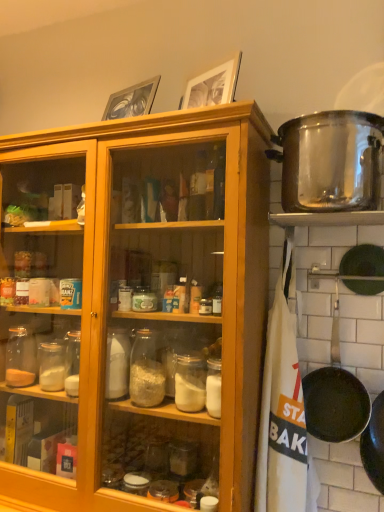
What do you see at coordinates (330, 161) in the screenshot?
I see `stainless steel pot at upper right` at bounding box center [330, 161].

At what (x,y) coordinates should I click in order to perform the action: click on stainless steel pot at upper right. Please return your answer as a coordinate pair (x, y). Image resolution: width=384 pixels, height=512 pixels. Looking at the image, I should click on (x=330, y=161).

What is the approximate height of black non-stick frying pan at lower right?

41.88 centimeters.

The height and width of the screenshot is (512, 384). Identify the location of black non-stick frying pan at lower right. (335, 397).

What do you see at coordinates (335, 397) in the screenshot? I see `black non-stick frying pan at lower right` at bounding box center [335, 397].

Locate an element on the screen. stainless steel pot at upper right is located at coordinates (330, 161).

Which is more to the left, stainless steel pot at upper right or black non-stick frying pan at lower right?

Positioned to the left is stainless steel pot at upper right.

Who is more distant, stainless steel pot at upper right or black non-stick frying pan at lower right?

Positioned behind is black non-stick frying pan at lower right.

Does point (325, 129) appear closer or farther from the camera than point (320, 415)?

Clearly, point (325, 129) is closer to the camera than point (320, 415).

In the scene shown: From the image's perspective, between stainless steel pot at upper right and black non-stick frying pan at lower right, which one is located above?

From the image's view, stainless steel pot at upper right is above.

From a real-world perspective, is stainless steel pot at upper right positioned under black non-stick frying pan at lower right based on gravity?

No, from a real-world perspective, stainless steel pot at upper right is not under black non-stick frying pan at lower right.

Which object is wider, stainless steel pot at upper right or black non-stick frying pan at lower right?

Wider between the two is stainless steel pot at upper right.

Which of these two, stainless steel pot at upper right or black non-stick frying pan at lower right, stands shorter?

stainless steel pot at upper right.

Is stainless steel pot at upper right bigger than black non-stick frying pan at lower right?

Correct, stainless steel pot at upper right is larger in size than black non-stick frying pan at lower right.

Is stainless steel pot at upper right not within black non-stick frying pan at lower right?

Yes, stainless steel pot at upper right is outside of black non-stick frying pan at lower right.

Is there a large distance between stainless steel pot at upper right and black non-stick frying pan at lower right?

No, there isn't a large distance between stainless steel pot at upper right and black non-stick frying pan at lower right.

Is stainless steel pot at upper right looking in the opposite direction of black non-stick frying pan at lower right?

No, stainless steel pot at upper right is not facing the opposite direction of black non-stick frying pan at lower right.

Looking at this image, how distant is stainless steel pot at upper right from black non-stick frying pan at lower right?

20.70 inches.

Where is `pot/pan in front of the black non-stick frying pan at lower right`? pot/pan in front of the black non-stick frying pan at lower right is located at coordinates (330, 161).

In the scene shown: Considering the positions of objects black non-stick frying pan at lower right and stainless steel pot at upper right in the image provided, who is more to the right, black non-stick frying pan at lower right or stainless steel pot at upper right?

Positioned to the right is black non-stick frying pan at lower right.

In the scene shown: Considering the relative positions of black non-stick frying pan at lower right and stainless steel pot at upper right in the image provided, is black non-stick frying pan at lower right behind stainless steel pot at upper right?

Yes, it is behind stainless steel pot at upper right.

Which point is more forward, (347, 394) or (299, 143)?

The point (299, 143) is in front.

From the image's perspective, which is above, black non-stick frying pan at lower right or stainless steel pot at upper right?

stainless steel pot at upper right is shown above in the image.

From a real-world perspective, is black non-stick frying pan at lower right physically located above or below stainless steel pot at upper right?

black non-stick frying pan at lower right is below stainless steel pot at upper right.

Considering the sizes of black non-stick frying pan at lower right and stainless steel pot at upper right in the image, is black non-stick frying pan at lower right wider or thinner than stainless steel pot at upper right?

Clearly, black non-stick frying pan at lower right has less width compared to stainless steel pot at upper right.

Consider the image. Is black non-stick frying pan at lower right taller than stainless steel pot at upper right?

Yes.

Considering the sizes of objects black non-stick frying pan at lower right and stainless steel pot at upper right in the image provided, who is bigger, black non-stick frying pan at lower right or stainless steel pot at upper right?

Bigger between the two is stainless steel pot at upper right.

Choose the correct answer: Is black non-stick frying pan at lower right inside stainless steel pot at upper right or outside it?

black non-stick frying pan at lower right lies outside stainless steel pot at upper right.

Is black non-stick frying pan at lower right positioned far away from stainless steel pot at upper right?

No, there isn't a large distance between black non-stick frying pan at lower right and stainless steel pot at upper right.

In the scene shown: Is stainless steel pot at upper right at the back of black non-stick frying pan at lower right?

No, black non-stick frying pan at lower right's orientation is not away from stainless steel pot at upper right.

Identify the location of frying pan that is under the stainless steel pot at upper right (from a real-world perspective). 335,397.

This screenshot has width=384, height=512. In order to click on frying pan on the right of stainless steel pot at upper right in this screenshot , I will do [335, 397].

Image resolution: width=384 pixels, height=512 pixels. I want to click on pot/pan in front of the black non-stick frying pan at lower right, so click(330, 161).